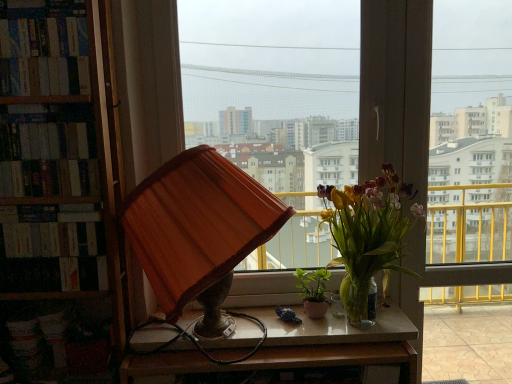
What do you see at coordinates (51, 231) in the screenshot?
I see `hardcover book at left, which appears as the first book when ordered from the bottom` at bounding box center [51, 231].

Locate an element on the screen. The height and width of the screenshot is (384, 512). translucent glass vase at center, which is the 1th houseplant in right-to-left order is located at coordinates (368, 235).

The image size is (512, 384). What do you see at coordinates (44, 48) in the screenshot?
I see `hardcover books at left, the 3th book from the bottom` at bounding box center [44, 48].

What do you see at coordinates (313, 291) in the screenshot?
I see `green matte plant at center, marked as the 1th houseplant in a left-to-right arrangement` at bounding box center [313, 291].

What is the approximate height of transparent glass window at center, which is the 1th window from right to left?

1.57 meters.

What do you see at coordinates (471, 133) in the screenshot? The height and width of the screenshot is (384, 512). I see `transparent glass window at center, positioned as the second window in left-to-right order` at bounding box center [471, 133].

Image resolution: width=512 pixels, height=384 pixels. What do you see at coordinates (49, 153) in the screenshot?
I see `hardcover books at left, placed as the second book when sorted from top to bottom` at bounding box center [49, 153].

Where is `hardcover books at left, placed as the second book when sorted from top to bottom`? The width and height of the screenshot is (512, 384). hardcover books at left, placed as the second book when sorted from top to bottom is located at coordinates pos(49,153).

Where is `hardcover book at left, the 3th book in the top-to-bottom sequence`? The width and height of the screenshot is (512, 384). hardcover book at left, the 3th book in the top-to-bottom sequence is located at coordinates (51, 231).

Considering the relative positions of translucent glass vase at center, placed as the second houseplant when sorted from left to right, and transparent glass window at center, which is the 1th window from right to left, in the image provided, is translucent glass vase at center, placed as the second houseplant when sorted from left to right, to the left of transparent glass window at center, which is the 1th window from right to left, from the viewer's perspective?

Yes, translucent glass vase at center, placed as the second houseplant when sorted from left to right, is to the left of transparent glass window at center, which is the 1th window from right to left.

From a real-world perspective, which houseplant is the 1st one underneath the transparent glass window at center, which is the 1th window from right to left? Please provide its 2D coordinates.

[(368, 235)]

From a real-world perspective, is translucent glass vase at center, which is the 1th houseplant in right-to-left order, below transparent glass window at center, which is the 1th window from right to left?

Yes, from a real-world perspective, translucent glass vase at center, which is the 1th houseplant in right-to-left order, is beneath transparent glass window at center, which is the 1th window from right to left.

Considering the sizes of translucent glass vase at center, placed as the second houseplant when sorted from left to right, and transparent glass window at center, positioned as the second window in left-to-right order, in the image, is translucent glass vase at center, placed as the second houseplant when sorted from left to right, bigger or smaller than transparent glass window at center, positioned as the second window in left-to-right order,?

Considering their sizes, translucent glass vase at center, placed as the second houseplant when sorted from left to right, takes up less space than transparent glass window at center, positioned as the second window in left-to-right order.

Does matte wooden lampshade at center, the second window positioned from the right, have a larger size compared to green matte plant at center, which is the 2th houseplant from right to left?

Yes.

Is matte wooden lampshade at center, the 1th window positioned from the left, oriented towards green matte plant at center, which is the 2th houseplant from right to left?

Yes, matte wooden lampshade at center, the 1th window positioned from the left, is turned towards green matte plant at center, which is the 2th houseplant from right to left.

Does matte wooden lampshade at center, the second window positioned from the right, have a lesser height compared to green matte plant at center, which is the 2th houseplant from right to left?

No.

Is green matte plant at center, marked as the 1th houseplant in a left-to-right arrangement, surrounded by matte wooden lampshade at center, the 1th window positioned from the left?

No.

Considering the relative positions of transparent glass window at center, positioned as the second window in left-to-right order, and matte wooden lampshade at center, the 1th window positioned from the left, in the image provided, is transparent glass window at center, positioned as the second window in left-to-right order, behind matte wooden lampshade at center, the 1th window positioned from the left,?

Yes, it is.

Is transparent glass window at center, which is the 1th window from right to left, not inside matte wooden lampshade at center, the second window positioned from the right?

That's correct, transparent glass window at center, which is the 1th window from right to left, is outside of matte wooden lampshade at center, the second window positioned from the right.

Locate an element on the screen. window in front of the transparent glass window at center, which is the 1th window from right to left is located at coordinates (274, 87).

Can you confirm if transparent glass window at center, positioned as the second window in left-to-right order, is smaller than matte wooden lampshade at center, the second window positioned from the right?

No.

What's the angular difference between orange fabric lampshade at center and green matte plant at center, which is the 2th houseplant from right to left,'s facing directions?

There is a 5.4-degree angle between the facing directions of orange fabric lampshade at center and green matte plant at center, which is the 2th houseplant from right to left.

Which is in front, point (138, 187) or point (317, 301)?

Positioned in front is point (138, 187).

Is orange fabric lampshade at center oriented towards green matte plant at center, which is the 2th houseplant from right to left?

No, orange fabric lampshade at center is not facing towards green matte plant at center, which is the 2th houseplant from right to left.

Is orange fabric lampshade at center smaller than green matte plant at center, which is the 2th houseplant from right to left?

Actually, orange fabric lampshade at center might be larger than green matte plant at center, which is the 2th houseplant from right to left.

From the image's perspective, which one is positioned higher, matte wooden lampshade at center, the 1th window positioned from the left, or orange fabric lampshade at center?

matte wooden lampshade at center, the 1th window positioned from the left, appears higher in the image.

How many degrees apart are the facing directions of matte wooden lampshade at center, the 1th window positioned from the left, and orange fabric lampshade at center?

2.43 degrees separate the facing orientations of matte wooden lampshade at center, the 1th window positioned from the left, and orange fabric lampshade at center.

Considering the sizes of matte wooden lampshade at center, the 1th window positioned from the left, and orange fabric lampshade at center in the image, is matte wooden lampshade at center, the 1th window positioned from the left, bigger or smaller than orange fabric lampshade at center?

Clearly, matte wooden lampshade at center, the 1th window positioned from the left, is smaller in size than orange fabric lampshade at center.

From a real-world perspective, who is located lower, matte wooden lampshade at center, the 1th window positioned from the left, or orange fabric lampshade at center?

orange fabric lampshade at center.

Considering the sizes of objects wooden desk at center and hardcover books at left, placed as the second book when sorted from top to bottom, in the image provided, who is wider, wooden desk at center or hardcover books at left, placed as the second book when sorted from top to bottom,?

With larger width is wooden desk at center.

Is wooden desk at center oriented away from hardcover books at left, placed as the second book when sorted from top to bottom?

No, hardcover books at left, placed as the second book when sorted from top to bottom, is not at the back of wooden desk at center.

Where is `desk directly beneath the hardcover books at left, placed as the second book when sorted from top to bottom (from a real-world perspective)`? desk directly beneath the hardcover books at left, placed as the second book when sorted from top to bottom (from a real-world perspective) is located at coordinates (295, 347).

Based on the photo, from a real-world perspective, is wooden desk at center under hardcover books at left, placed as the second book when sorted from top to bottom?

Correct, in the physical world, wooden desk at center is lower than hardcover books at left, placed as the second book when sorted from top to bottom.

Is there a large distance between orange fabric lampshade at center and matte wooden lampshade at center, the 1th window positioned from the left?

That's not correct — orange fabric lampshade at center is a little close to matte wooden lampshade at center, the 1th window positioned from the left.

Would you say orange fabric lampshade at center is to the left or to the right of matte wooden lampshade at center, the second window positioned from the right, in the picture?

From the image, it's evident that orange fabric lampshade at center is to the left of matte wooden lampshade at center, the second window positioned from the right.

Is point (184, 160) positioned in front of point (303, 184)?

Yes, it is in front of point (303, 184).

There is a transparent glass window at center, which is the 1th window from right to left. Where is `the 1st houseplant below it (from the image's perspective)`? The width and height of the screenshot is (512, 384). the 1st houseplant below it (from the image's perspective) is located at coordinates (368, 235).

From the image's perspective, starting from the green matte plant at center, marked as the 1th houseplant in a left-to-right arrangement, which window is the 2nd one above? Please provide its 2D coordinates.

[(274, 87)]

When comparing their distances from orange fabric lampshade at center, does matte wooden lampshade at center, the second window positioned from the right, or hardcover books at left, placed as the second book when sorted from top to bottom, seem closer?

Based on the image, hardcover books at left, placed as the second book when sorted from top to bottom, appears to be nearer to orange fabric lampshade at center.

In the scene shown: Which object lies nearer to the anchor point green matte plant at center, marked as the 1th houseplant in a left-to-right arrangement, transparent glass window at center, positioned as the second window in left-to-right order, or matte wooden lampshade at center, the 1th window positioned from the left?

matte wooden lampshade at center, the 1th window positioned from the left.

Which object lies further to the anchor point hardcover books at left, placed as the second book when sorted from top to bottom, green matte plant at center, marked as the 1th houseplant in a left-to-right arrangement, or orange fabric lampshade at center?

green matte plant at center, marked as the 1th houseplant in a left-to-right arrangement, is further to hardcover books at left, placed as the second book when sorted from top to bottom.

Looking at this image, based on their spatial positions, is green matte plant at center, marked as the 1th houseplant in a left-to-right arrangement, or hardcover books at left, the 1th book when ordered from top to bottom, further from transparent glass window at center, which is the 1th window from right to left?

hardcover books at left, the 1th book when ordered from top to bottom.

Estimate the real-world distances between objects in this image. Which object is further from orange fabric lampshade at center, matte wooden lampshade at center, the 1th window positioned from the left, or green matte plant at center, marked as the 1th houseplant in a left-to-right arrangement?

Based on the image, green matte plant at center, marked as the 1th houseplant in a left-to-right arrangement, appears to be further to orange fabric lampshade at center.

From the image, which object appears to be farther from matte wooden lampshade at center, the second window positioned from the right, green matte plant at center, which is the 2th houseplant from right to left, or transparent glass window at center, which is the 1th window from right to left?

Based on the image, green matte plant at center, which is the 2th houseplant from right to left, appears to be further to matte wooden lampshade at center, the second window positioned from the right.

When comparing their distances from matte wooden lampshade at center, the 1th window positioned from the left, does hardcover books at left, the 3th book from the bottom, or green matte plant at center, which is the 2th houseplant from right to left, seem closer?

hardcover books at left, the 3th book from the bottom, is positioned closer to the anchor matte wooden lampshade at center, the 1th window positioned from the left.

Which object lies further to the anchor point orange fabric lampshade at center, translucent glass vase at center, placed as the second houseplant when sorted from left to right, or transparent glass window at center, which is the 1th window from right to left?

Among the two, transparent glass window at center, which is the 1th window from right to left, is located further to orange fabric lampshade at center.

Find the location of a particular element. The image size is (512, 384). lamp located between hardcover books at left, the second book ordered from the bottom, and wooden desk at center in the left-right direction is located at coordinates (198, 231).

Locate an element on the screen. Image resolution: width=512 pixels, height=384 pixels. lamp situated between hardcover books at left, the second book ordered from the bottom, and matte wooden lampshade at center, the 1th window positioned from the left, from left to right is located at coordinates (198, 231).

Where is `book located between hardcover books at left, placed as the second book when sorted from top to bottom, and transparent glass window at center, positioned as the second window in left-to-right order, in the left-right direction`? The width and height of the screenshot is (512, 384). book located between hardcover books at left, placed as the second book when sorted from top to bottom, and transparent glass window at center, positioned as the second window in left-to-right order, in the left-right direction is located at coordinates (44, 48).

I want to click on houseplant between green matte plant at center, which is the 2th houseplant from right to left, and transparent glass window at center, which is the 1th window from right to left, in the horizontal direction, so click(368, 235).